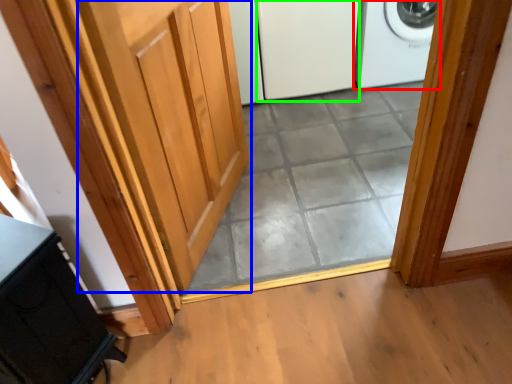
Question: Based on their relative distances, which object is nearer to home appliance (highlighted by a red box)? Choose from door (highlighted by a blue box) and screen door (highlighted by a green box).

Choices:
 (A) door
 (B) screen door

Answer: (B)